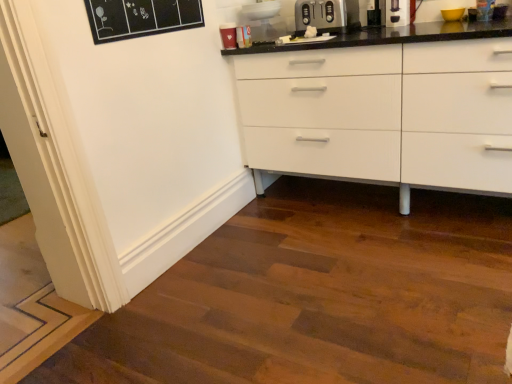
Image resolution: width=512 pixels, height=384 pixels. What do you see at coordinates (390, 12) in the screenshot?
I see `black plastic coffee machine at upper right` at bounding box center [390, 12].

At what (x,y) coordinates should I click in order to perform the action: click on black plastic coffee machine at upper right. Please return your answer as a coordinate pair (x, y). The height and width of the screenshot is (384, 512). Looking at the image, I should click on (390, 12).

Locate an element on the screen. Image resolution: width=512 pixels, height=384 pixels. satin silver toaster at upper center is located at coordinates (327, 16).

Measure the distance between point (324, 2) and camera.

Point (324, 2) and camera are 2.30 meters apart from each other.

What do you see at coordinates (327, 16) in the screenshot? I see `satin silver toaster at upper center` at bounding box center [327, 16].

This screenshot has height=384, width=512. What are the coordinates of `black plastic coffee machine at upper right` in the screenshot? It's located at (390, 12).

Is satin silver toaster at upper center to the left of black plastic coffee machine at upper right from the viewer's perspective?

Yes.

Which object is further away from the camera, satin silver toaster at upper center or black plastic coffee machine at upper right?

satin silver toaster at upper center.

Considering the positions of points (350, 3) and (393, 11), is point (350, 3) farther from camera compared to point (393, 11)?

Yes, point (350, 3) is behind point (393, 11).

From the image's perspective, is satin silver toaster at upper center located above or below black plastic coffee machine at upper right?

satin silver toaster at upper center is below black plastic coffee machine at upper right.

Consider the image. From a real-world perspective, is satin silver toaster at upper center below black plastic coffee machine at upper right?

Yes, from a real-world perspective, satin silver toaster at upper center is beneath black plastic coffee machine at upper right.

Does satin silver toaster at upper center have a lesser width compared to black plastic coffee machine at upper right?

In fact, satin silver toaster at upper center might be wider than black plastic coffee machine at upper right.

Does satin silver toaster at upper center have a lesser height compared to black plastic coffee machine at upper right?

Yes.

Is satin silver toaster at upper center smaller than black plastic coffee machine at upper right?

No.

Is black plastic coffee machine at upper right surrounded by satin silver toaster at upper center?

Definitely not — black plastic coffee machine at upper right is not inside satin silver toaster at upper center.

Would you say satin silver toaster at upper center is a long distance from black plastic coffee machine at upper right?

That's not correct — satin silver toaster at upper center is a little close to black plastic coffee machine at upper right.

Does satin silver toaster at upper center turn towards black plastic coffee machine at upper right?

No.

You are a GUI agent. You are given a task and a screenshot of the screen. Output one action in this format:
    pyautogui.click(x=<x>, y=<y>)
    Task: Click on the coffee machine in front of the satin silver toaster at upper center
    The height and width of the screenshot is (384, 512).
    Given the screenshot: What is the action you would take?
    pyautogui.click(x=390, y=12)

Considering the relative positions of black plastic coffee machine at upper right and satin silver toaster at upper center in the image provided, is black plastic coffee machine at upper right to the right of satin silver toaster at upper center from the viewer's perspective?

Yes, black plastic coffee machine at upper right is to the right of satin silver toaster at upper center.

Is the position of black plastic coffee machine at upper right more distant than that of satin silver toaster at upper center?

No, black plastic coffee machine at upper right is closer to the camera.

Which is behind, point (390, 22) or point (346, 8)?

The point (346, 8) is more distant.

From the image's perspective, is black plastic coffee machine at upper right over satin silver toaster at upper center?

Correct, black plastic coffee machine at upper right appears higher than satin silver toaster at upper center in the image.

From a real-world perspective, is black plastic coffee machine at upper right physically above satin silver toaster at upper center?

Indeed, from a real-world perspective, black plastic coffee machine at upper right stands above satin silver toaster at upper center.

Is black plastic coffee machine at upper right wider than satin silver toaster at upper center?

In fact, black plastic coffee machine at upper right might be narrower than satin silver toaster at upper center.

Is black plastic coffee machine at upper right taller than satin silver toaster at upper center?

Yes, black plastic coffee machine at upper right is taller than satin silver toaster at upper center.

Is black plastic coffee machine at upper right smaller than satin silver toaster at upper center?

Yes, black plastic coffee machine at upper right is smaller than satin silver toaster at upper center.

Is satin silver toaster at upper center surrounded by black plastic coffee machine at upper right?

No, satin silver toaster at upper center is not inside black plastic coffee machine at upper right.

Is black plastic coffee machine at upper right positioned far away from satin silver toaster at upper center?

No.

Could you tell me if black plastic coffee machine at upper right is facing satin silver toaster at upper center?

No, black plastic coffee machine at upper right does not turn towards satin silver toaster at upper center.

How different are the orientations of black plastic coffee machine at upper right and satin silver toaster at upper center in degrees?

0.00117 degrees.

Find the location of a particular element. appliance behind the black plastic coffee machine at upper right is located at coordinates (327, 16).

Where is `coffee machine above the satin silver toaster at upper center (from the image's perspective)`? Image resolution: width=512 pixels, height=384 pixels. coffee machine above the satin silver toaster at upper center (from the image's perspective) is located at coordinates (390, 12).

At what (x,y) coordinates should I click in order to perform the action: click on appliance on the left of black plastic coffee machine at upper right. Please return your answer as a coordinate pair (x, y). Looking at the image, I should click on (327, 16).